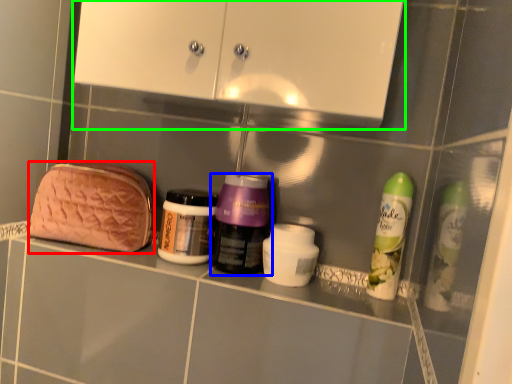
Question: Which object is the closest to the pouch (highlighted by a red box)? Choose among these: bottle (highlighted by a blue box) or medicine cabinet (highlighted by a green box).

Choices:
 (A) bottle
 (B) medicine cabinet

Answer: (A)